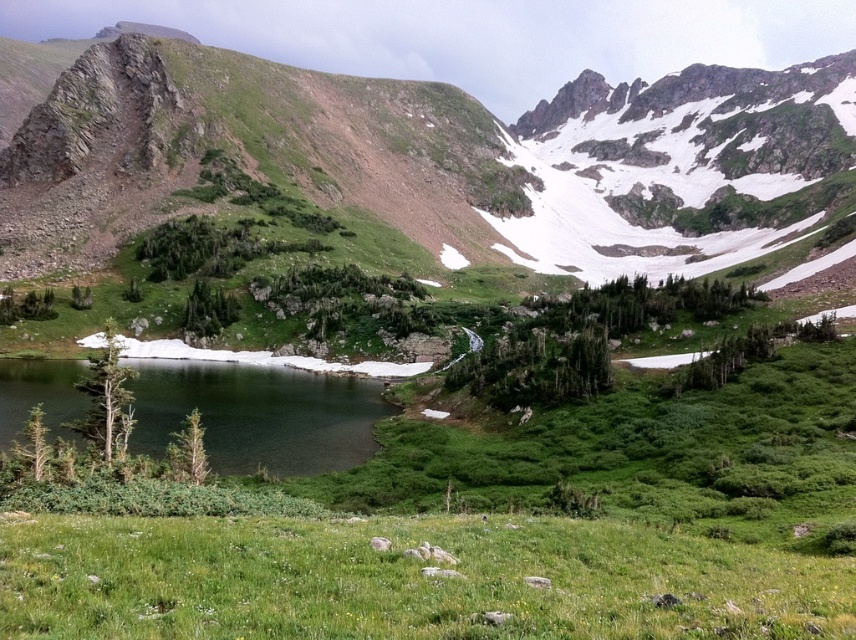
You are planning to set up a picnic area in the image. You have a large picnic blanket that can cover an area as big as the green glassy water at lower left. Will the green grassy field at lower center be sufficient to accommodate the blanket?

The green grassy field at lower center is smaller than the green glassy water at lower left, so it cannot accommodate the picnic blanket designed for the size of the green glassy water at lower left.

You are a hiker standing at the edge of the green grassy field at lower center and want to reach the green glassy water at lower left. Which direction should you move to get closer to the water?

The green grassy field at lower center has a lesser height compared to green glassy water at lower left, so you should move towards the lower left direction to reach the water.